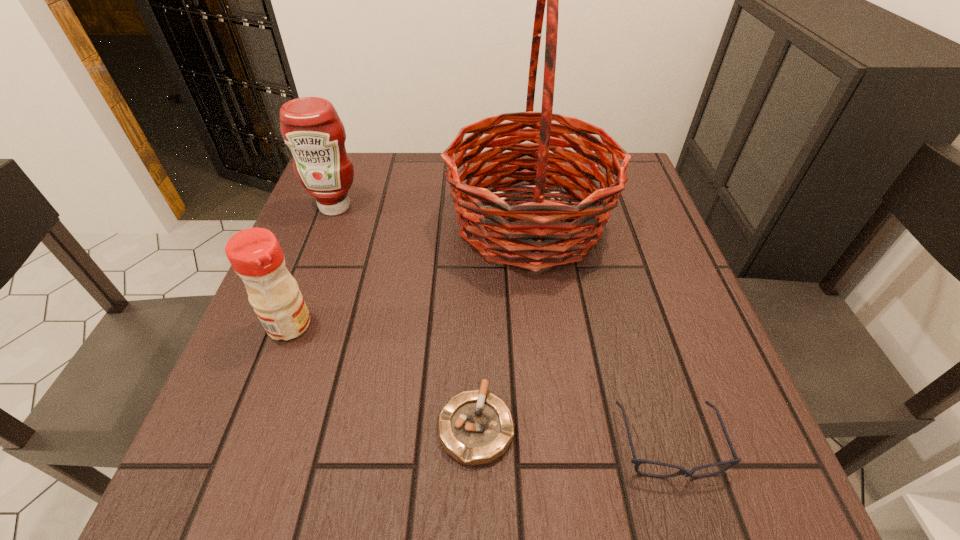
Locate an element on the screen. Image resolution: width=960 pixels, height=540 pixels. blank region between the tallest object and the taller condiment is located at coordinates (432, 215).

Locate an element on the screen. The height and width of the screenshot is (540, 960). free space between the tallest object and the farther condiment is located at coordinates pos(432,215).

Where is `free space between the third nearest object and the shortest object`? free space between the third nearest object and the shortest object is located at coordinates (383, 375).

At what (x,y) coordinates should I click in order to perform the action: click on vacant area that lies between the ashtray and the farther condiment. Please return your answer as a coordinate pair (x, y). Looking at the image, I should click on (405, 316).

Where is `empty space that is in between the farther condiment and the third shortest object`? empty space that is in between the farther condiment and the third shortest object is located at coordinates (312, 266).

You are a GUI agent. You are given a task and a screenshot of the screen. Output one action in this format:
    pyautogui.click(x=<x>, y=<y>)
    Task: Click on the blank region between the shortest object and the spectacles
    The image size is (960, 540).
    Given the screenshot: What is the action you would take?
    coord(572,435)

The image size is (960, 540). What are the coordinates of `vacant space in between the spectacles and the farther condiment` in the screenshot? It's located at (501, 326).

Identify the location of free area in between the basket and the spectacles. This screenshot has height=540, width=960. (599, 334).

The image size is (960, 540). I want to click on object that is the second closest one to the second shortest object, so click(x=518, y=235).

Choose which object is the second nearest neighbor to the spectacles. Please provide its 2D coordinates. Your answer should be formatted as a tuple, i.e. [(x, y)], where the tuple contains the x and y coordinates of a point satisfying the conditions above.

[(518, 235)]